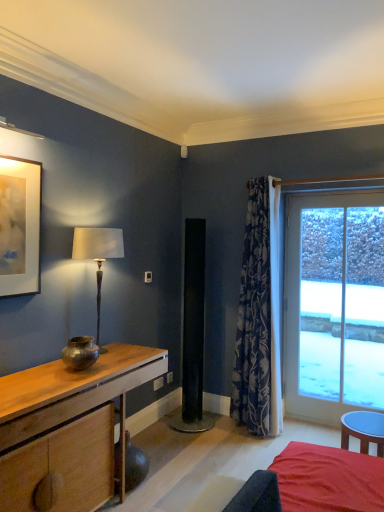
Locate an element on the screen. This screenshot has width=384, height=512. free location in front of bronze metallic vase at left is located at coordinates (66, 380).